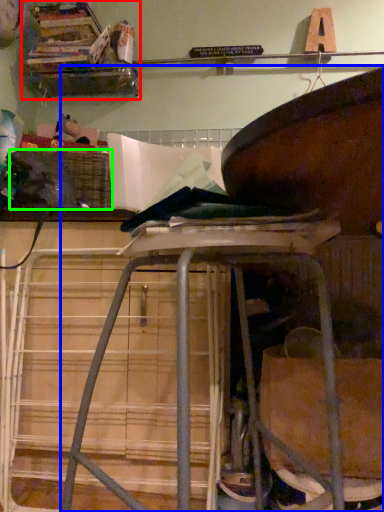
Question: Considering the real-world distances, which object is closest to shelf (highlighted by a red box)? furniture (highlighted by a blue box) or crate (highlighted by a green box).

Choices:
 (A) furniture
 (B) crate

Answer: (B)